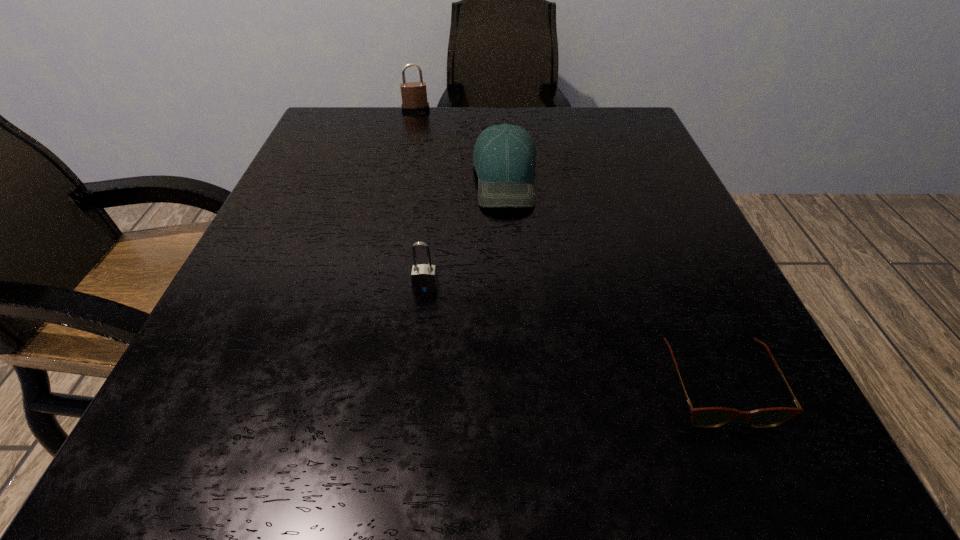
This screenshot has width=960, height=540. In order to click on free region located 0.390m on the front of the second object from right to left in this screenshot , I will do `click(522, 422)`.

What are the coordinates of `padlock that is at the far edge` in the screenshot? It's located at pos(414,94).

Identify the location of baseball cap located at the far edge. The height and width of the screenshot is (540, 960). (504, 157).

Identify the location of object located at the near edge. This screenshot has height=540, width=960. (708, 417).

Locate an element on the screen. The image size is (960, 540). object positioned at the right edge is located at coordinates (708, 417).

The width and height of the screenshot is (960, 540). I want to click on object present at the near right corner, so click(x=708, y=417).

You are a GUI agent. You are given a task and a screenshot of the screen. Output one action in this format:
    pyautogui.click(x=<x>, y=<y>)
    Task: Click on the free space at the far edge
    The width and height of the screenshot is (960, 540).
    Given the screenshot: What is the action you would take?
    pyautogui.click(x=502, y=120)

The height and width of the screenshot is (540, 960). I want to click on vacant space at the near edge of the desktop, so click(592, 470).

I want to click on vacant region at the left edge of the desktop, so click(x=214, y=389).

Locate an element on the screen. Image resolution: width=960 pixels, height=540 pixels. vacant space at the right edge of the desktop is located at coordinates (596, 200).